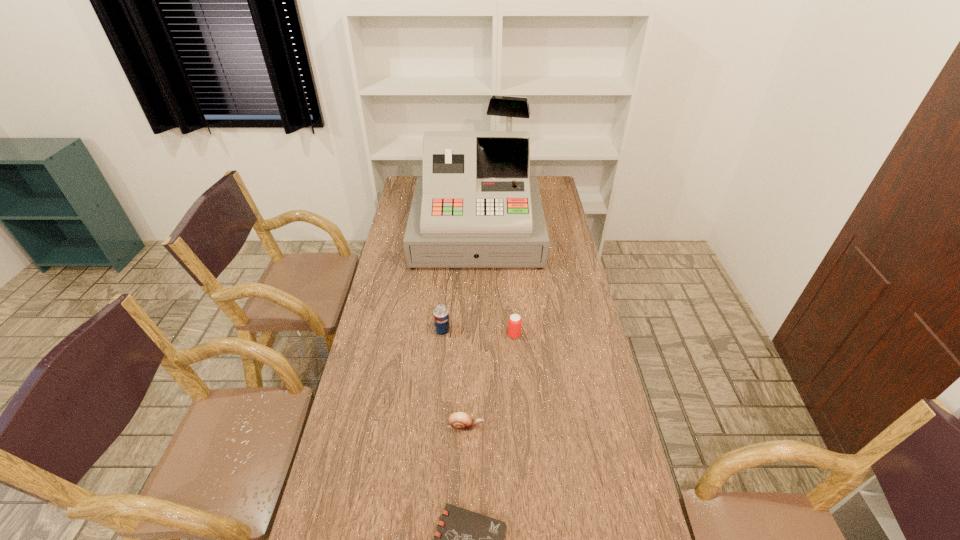
The image size is (960, 540). Identify the location of cash register. tap(475, 206).

You are a GUI agent. You are given a task and a screenshot of the screen. Output one action in this format:
    pyautogui.click(x=<x>, y=<y>)
    Task: Click on the tallest object
    Image resolution: width=960 pixels, height=540 pixels.
    Given the screenshot: What is the action you would take?
    pyautogui.click(x=475, y=206)

You are a GUI agent. You are given a task and a screenshot of the screen. Output one action in this format:
    pyautogui.click(x=<x>, y=<y>)
    Task: Click on the taller beer can
    This screenshot has height=540, width=960.
    Given the screenshot: What is the action you would take?
    pyautogui.click(x=440, y=313)

Image resolution: width=960 pixels, height=540 pixels. In order to click on the fourth shortest object in this screenshot , I will do `click(440, 313)`.

Image resolution: width=960 pixels, height=540 pixels. Find the location of `the right beer can`. the right beer can is located at coordinates (514, 322).

The height and width of the screenshot is (540, 960). In order to click on the shorter beer can in this screenshot , I will do `click(514, 322)`.

Locate an element on the screen. This screenshot has width=960, height=540. the second nearest object is located at coordinates (461, 421).

This screenshot has width=960, height=540. I want to click on the second shortest object, so click(x=461, y=421).

Where is `vacant space situated 0.220m on the keypad side of the tallest object`? This screenshot has width=960, height=540. vacant space situated 0.220m on the keypad side of the tallest object is located at coordinates (x=476, y=308).

You are a GUI agent. You are given a task and a screenshot of the screen. Output one action in this format:
    pyautogui.click(x=<x>, y=<y>)
    Task: Click on the blank space located 0.060m on the right of the left beer can
    
    Given the screenshot: What is the action you would take?
    pyautogui.click(x=467, y=331)